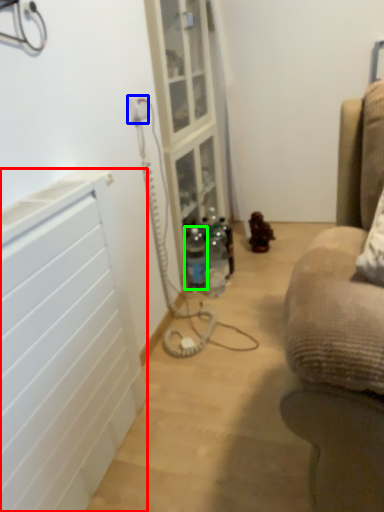
Question: Considering the real-world distances, which object is farthest from radiator (highlighted by a red box)? electric outlet (highlighted by a blue box) or bottle (highlighted by a green box)?

Choices:
 (A) electric outlet
 (B) bottle

Answer: (B)